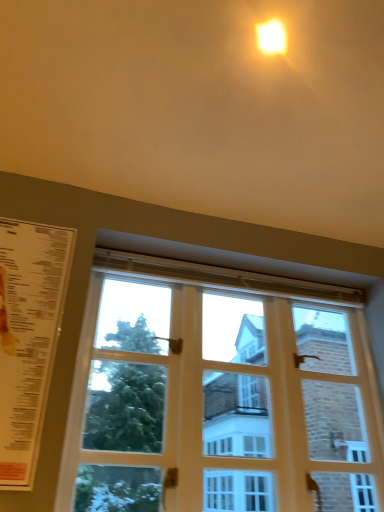
In order to click on white paper menu at left in this screenshot , I will do `click(28, 337)`.

Measure the distance between white paper menu at left and camera.

white paper menu at left and camera are 3.69 feet apart from each other.

Identify the location of matte yellow light at upper center. The height and width of the screenshot is (512, 384). (271, 37).

Considering the positions of point (119, 455) and point (56, 285), is point (119, 455) closer or farther from the camera than point (56, 285)?

Point (119, 455) appears to be closer to the viewer than point (56, 285).

From the image's perspective, would you say white wooden window at center is positioned over white paper menu at left?

No, from the image's perspective, white wooden window at center is not over white paper menu at left.

Is white paper menu at left located within white wooden window at center?

No, white paper menu at left is located outside of white wooden window at center.

In terms of size, does matte yellow light at upper center appear bigger or smaller than white paper menu at left?

In the image, matte yellow light at upper center appears to be smaller than white paper menu at left.

Can you tell me how much matte yellow light at upper center and white paper menu at left differ in facing direction?

85.7 degrees.

Which object is positioned more to the right, matte yellow light at upper center or white paper menu at left?

matte yellow light at upper center is more to the right.

Between matte yellow light at upper center and white paper menu at left, which one has larger width?

With larger width is matte yellow light at upper center.

Consider the image. Does white paper menu at left have a smaller size compared to white wooden window at center?

Correct, white paper menu at left occupies less space than white wooden window at center.

From a real-world perspective, is white paper menu at left on white wooden window at center?

Yes, from a real-world perspective, white paper menu at left is over white wooden window at center

From the picture: Which object is wider, white paper menu at left or white wooden window at center?

Wider between the two is white wooden window at center.

Measure the distance from white paper menu at left to white wooden window at center.

59.44 centimeters.

Consider the image. From a real-world perspective, is matte yellow light at upper center over white wooden window at center?

Yes, from a real-world perspective, matte yellow light at upper center is on top of white wooden window at center.

From the image's perspective, is matte yellow light at upper center located beneath white wooden window at center?

No.

Between matte yellow light at upper center and white wooden window at center, which one has larger width?

With larger width is matte yellow light at upper center.

Can you confirm if white paper menu at left is thinner than matte yellow light at upper center?

Yes.

In terms of size, does white paper menu at left appear bigger or smaller than matte yellow light at upper center?

In the image, white paper menu at left appears to be larger than matte yellow light at upper center.

Is white paper menu at left to the left or to the right of matte yellow light at upper center in the image?

white paper menu at left is positioned on matte yellow light at upper center's left side.

Who is more distant, white paper menu at left or matte yellow light at upper center?

matte yellow light at upper center is more distant.

Is white wooden window at center aimed at matte yellow light at upper center?

No, white wooden window at center does not turn towards matte yellow light at upper center.

From a real-world perspective, is white wooden window at center on top of matte yellow light at upper center?

No, from a real-world perspective, white wooden window at center is not over matte yellow light at upper center

Can you see white wooden window at center touching matte yellow light at upper center?

No, white wooden window at center is not touching matte yellow light at upper center.

Where is `window below the white paper menu at left (from the image's perspective)`? window below the white paper menu at left (from the image's perspective) is located at coordinates (219, 388).

This screenshot has height=512, width=384. Identify the location of menu below the matte yellow light at upper center (from a real-world perspective). (28, 337).

Estimate the real-world distances between objects in this image. Which object is closer to white wooden window at center, white paper menu at left or matte yellow light at upper center?

Based on the image, white paper menu at left appears to be nearer to white wooden window at center.

Which object lies further to the anchor point matte yellow light at upper center, white paper menu at left or white wooden window at center?

white wooden window at center.

When comparing their distances from matte yellow light at upper center, does white wooden window at center or white paper menu at left seem further?

white wooden window at center lies further to matte yellow light at upper center than the other object.

When comparing their distances from white paper menu at left, does white wooden window at center or matte yellow light at upper center seem further?

Among the two, matte yellow light at upper center is located further to white paper menu at left.

Looking at the image, which one is located closer to white paper menu at left, matte yellow light at upper center or white wooden window at center?

The object closer to white paper menu at left is white wooden window at center.

Based on their spatial positions, is matte yellow light at upper center or white paper menu at left closer to white wooden window at center?

white paper menu at left is closer to white wooden window at center.

Locate an element on the screen. menu between matte yellow light at upper center and white wooden window at center vertically is located at coordinates (28, 337).